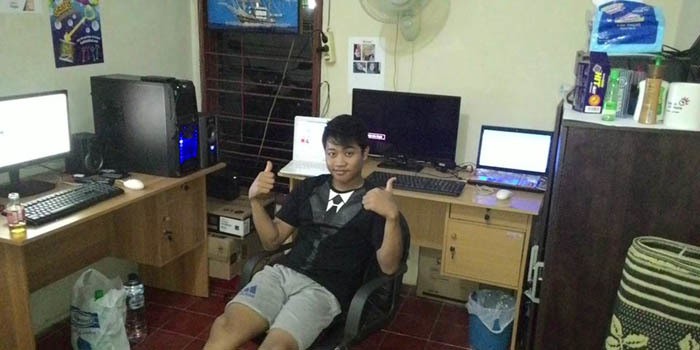
At what (x,y) coordinates should I click in order to perform the action: click on trashcan. Please return your answer as a coordinate pair (x, y). Looking at the image, I should click on (497, 333).